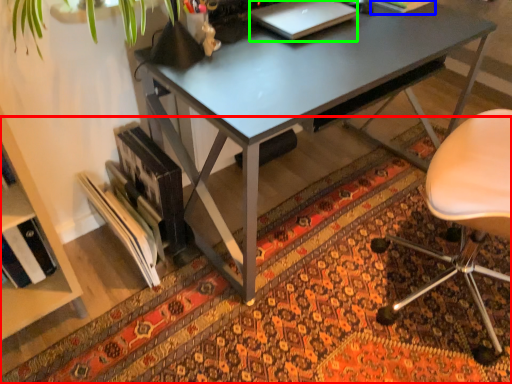
Question: Which is nearer to the mat (highlighted by a red box)? book (highlighted by a blue box) or laptop (highlighted by a green box).

Choices:
 (A) book
 (B) laptop

Answer: (B)